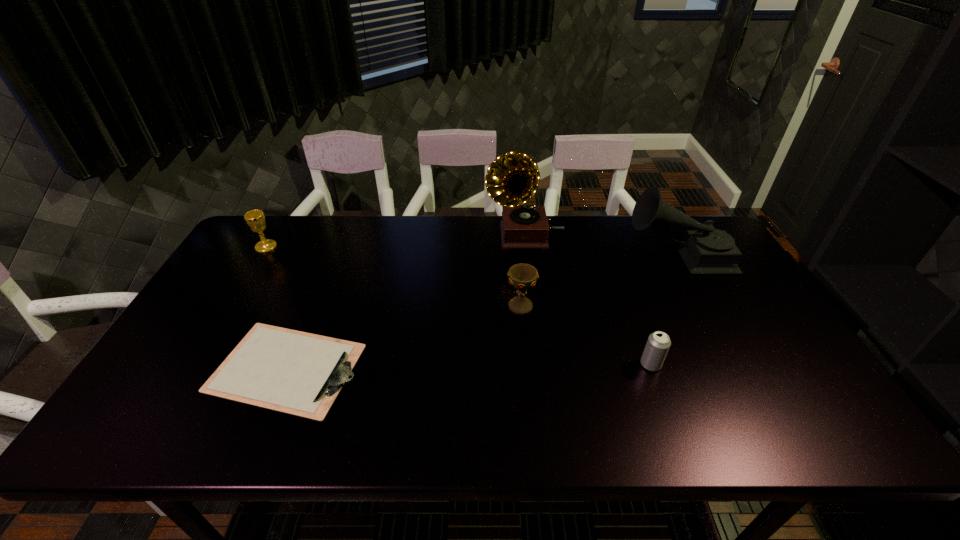
Find the location of a particular element. The image size is (960, 540). the taller phonograph_record is located at coordinates (512, 178).

Where is `the left phonograph_record`? The height and width of the screenshot is (540, 960). the left phonograph_record is located at coordinates (512, 178).

Locate an element on the screen. This screenshot has width=960, height=540. the fifth shortest object is located at coordinates (705, 250).

Where is `the right phonograph_record`? This screenshot has width=960, height=540. the right phonograph_record is located at coordinates (705, 250).

Locate an element on the screen. The image size is (960, 540). the leftmost object is located at coordinates (255, 219).

Locate an element on the screen. Image resolution: width=960 pixels, height=540 pixels. the left chalice is located at coordinates (255, 219).

This screenshot has width=960, height=540. Identify the location of the nearer chalice. (522, 277).

Where is `the right chalice`? the right chalice is located at coordinates (522, 277).

Where is `beer can`? beer can is located at coordinates (658, 344).

At what (x,y) coordinates should I click in order to perform the action: click on the fifth object from left to right. Please return your answer as a coordinate pair (x, y). The height and width of the screenshot is (540, 960). Looking at the image, I should click on (658, 344).